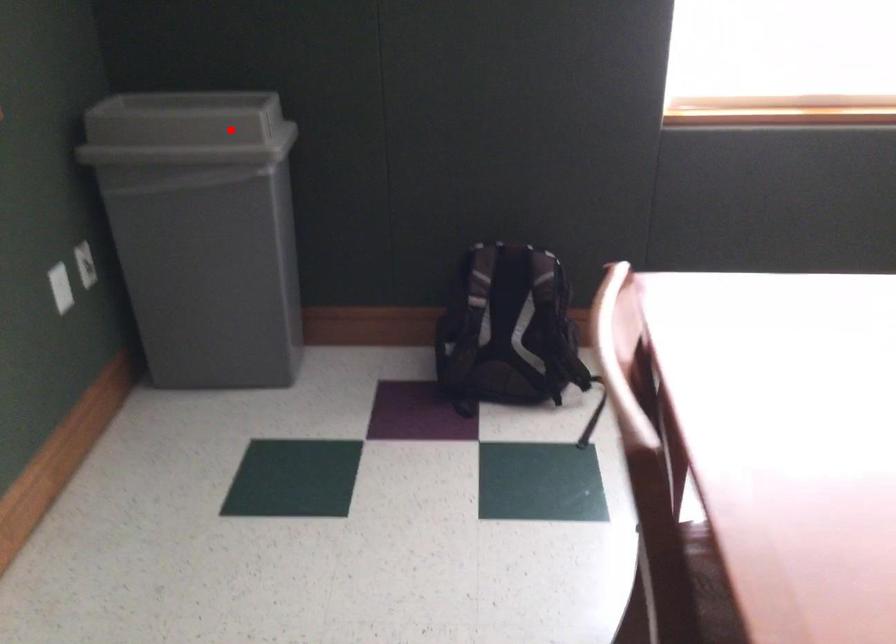
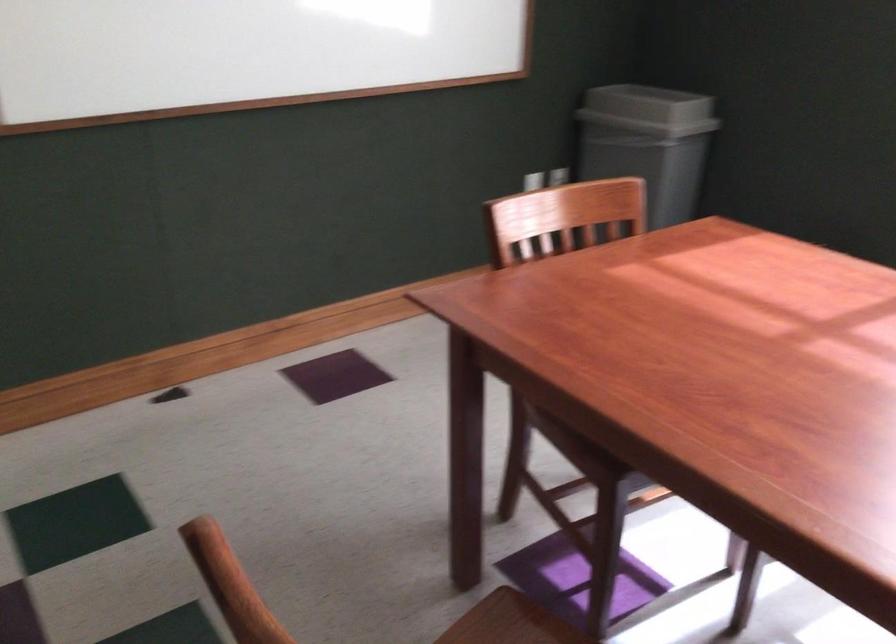
Question: A red point is marked in image1. In image2, is the corresponding 3D point closer to the camera or farther? Reply with the corresponding letter.

Choices:
 (A) The corresponding 3D point is closer.
 (B) The corresponding 3D point is farther.

Answer: (B)